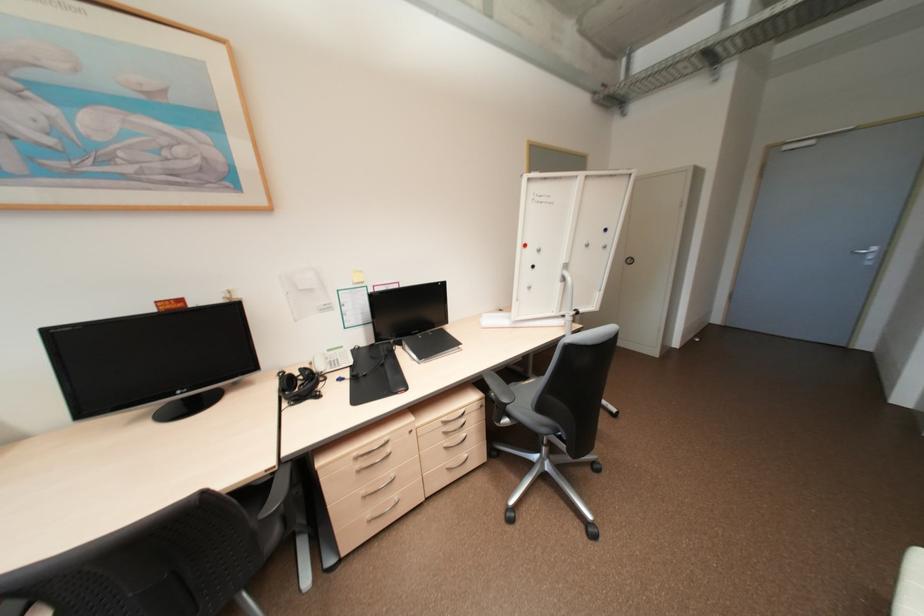
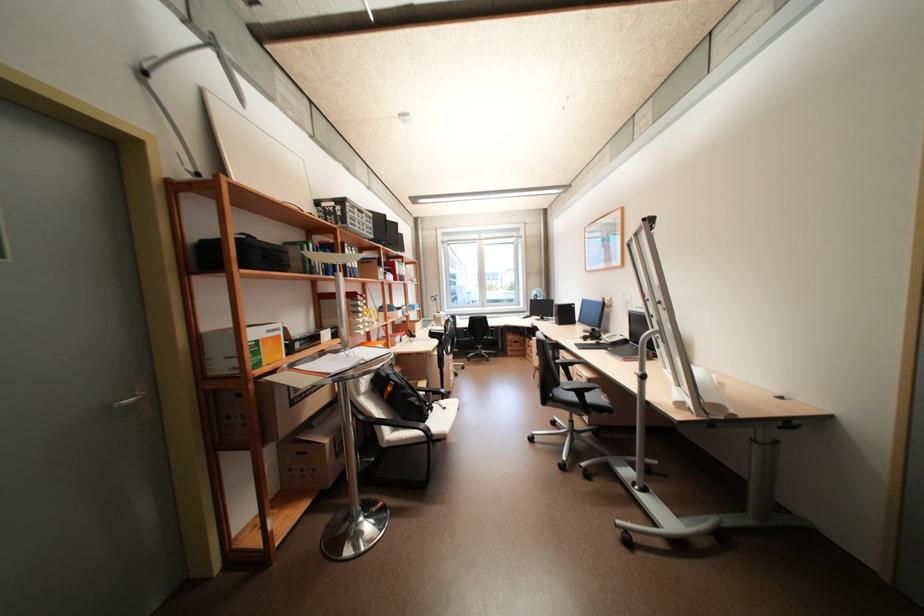
Locate, in the second image, the point that corresponds to pixel 346 379 in the first image.

(603, 342)